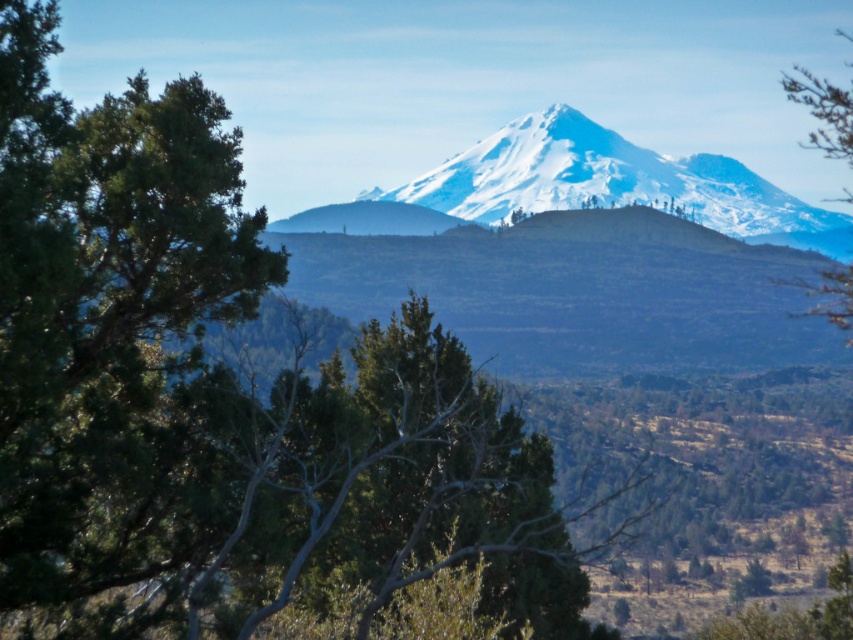
Is point (538, 195) behind point (828, 147)?

No.

Based on the photo, who is positioned more to the right, snowy white mountain at center or green matte tree at right?

Positioned to the right is green matte tree at right.

Does point (795, 244) lie behind point (815, 115)?

That is False.

Locate an element on the screen. snowy white mountain at center is located at coordinates (x=608, y=184).